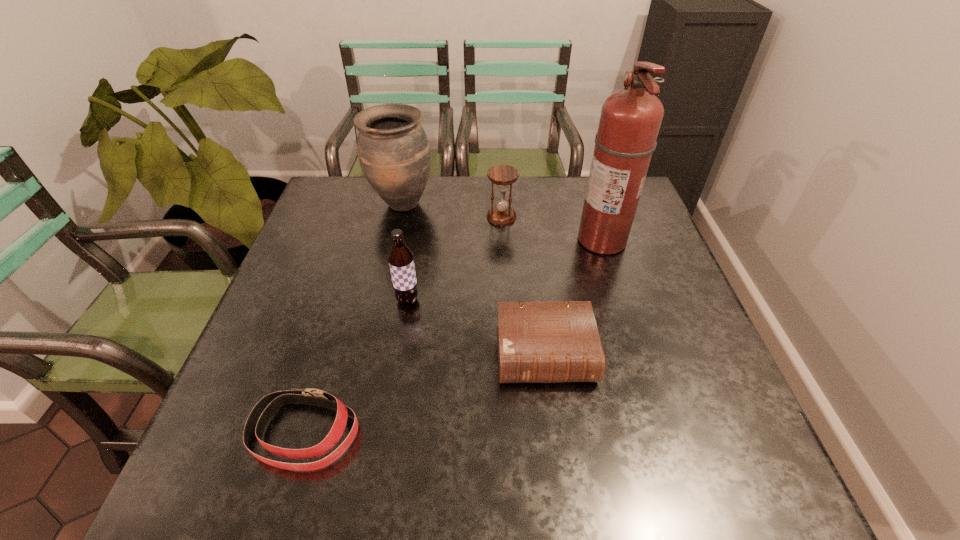
What are the coordinates of `vacant space located on the front-facing side of the rightmost object` in the screenshot? It's located at tap(437, 241).

Identify the location of vacant space located 0.070m on the front-facing side of the rightmost object. This screenshot has height=540, width=960. 552,241.

The image size is (960, 540). In order to click on free space located 0.380m on the front-facing side of the rightmost object in this screenshot , I will do `click(441, 241)`.

Locate an element on the screen. vacant space located 0.340m on the front of the second tallest object is located at coordinates (378, 311).

Where is `vacant point located 0.240m on the front of the third nearest object`? vacant point located 0.240m on the front of the third nearest object is located at coordinates (392, 399).

This screenshot has width=960, height=540. Identify the location of free space located 0.100m on the right of the third shortest object. (550, 217).

This screenshot has height=540, width=960. Identify the location of vacant point located on the spine side of the Bible. (559, 463).

Find the location of a particular element. The height and width of the screenshot is (540, 960). vacant space located on the right of the shortest object is located at coordinates (541, 433).

Where is `fire extinguisher located at the far edge`? The height and width of the screenshot is (540, 960). fire extinguisher located at the far edge is located at coordinates (630, 120).

In order to click on urn located at the far edge in this screenshot , I will do `click(394, 154)`.